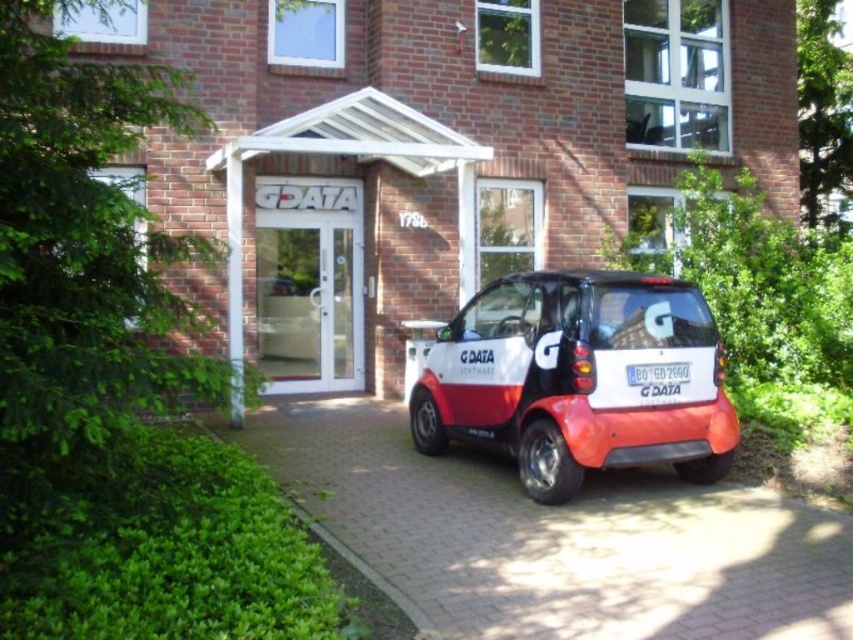
Question: Is matte white and red car at center smaller than white glass door at center?

Choices:
 (A) yes
 (B) no

Answer: (B)

Question: Which point is farther to the camera?

Choices:
 (A) (268, 358)
 (B) (674, 376)

Answer: (A)

Question: Is matte white and red car at center bigger than white glass door at center?

Choices:
 (A) no
 (B) yes

Answer: (B)

Question: Is matte white and red car at center wider than white glass door at center?

Choices:
 (A) no
 (B) yes

Answer: (B)

Question: Which object is positioned closest to the white glass door at center?

Choices:
 (A) matte white and red car at center
 (B) white plastic license plate at center

Answer: (A)

Question: Which of these objects is positioned farthest from the matte white and red car at center?

Choices:
 (A) white glass door at center
 (B) white plastic license plate at center

Answer: (A)